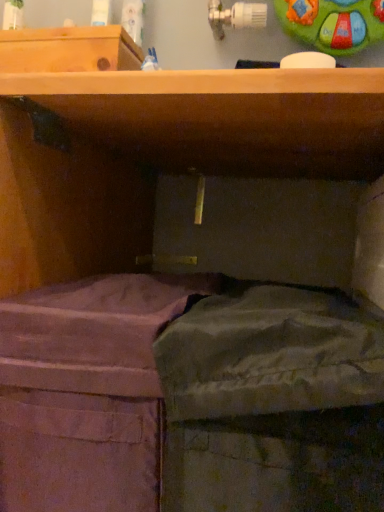
Question: Is pink fabric at lower left, which is the 1th wide from left to right, at the back of green crumpled paper at lower right, which is the 2th wide in left-to-right order?

Choices:
 (A) yes
 (B) no

Answer: (B)

Question: Does green crumpled paper at lower right, the first wide in the right-to-left sequence, have a larger size compared to pink fabric at lower left, which is the 1th wide from left to right?

Choices:
 (A) no
 (B) yes

Answer: (A)

Question: Does green crumpled paper at lower right, which is the 2th wide in left-to-right order, appear on the right side of pink fabric at lower left, which is the 1th wide from left to right?

Choices:
 (A) yes
 (B) no

Answer: (A)

Question: Can you confirm if green crumpled paper at lower right, which is the 2th wide in left-to-right order, is taller than pink fabric at lower left, the 2th wide viewed from the right?

Choices:
 (A) no
 (B) yes

Answer: (A)

Question: From the image's perspective, is green crumpled paper at lower right, the first wide in the right-to-left sequence, located beneath pink fabric at lower left, which is the 1th wide from left to right?

Choices:
 (A) yes
 (B) no

Answer: (B)

Question: Is green crumpled paper at lower right, the first wide in the right-to-left sequence, positioned before pink fabric at lower left, the 2th wide viewed from the right?

Choices:
 (A) yes
 (B) no

Answer: (A)

Question: Considering the relative sizes of pink fabric at lower left, the 2th wide viewed from the right, and green crumpled paper at lower right, which is the 2th wide in left-to-right order, in the image provided, is pink fabric at lower left, the 2th wide viewed from the right, taller than green crumpled paper at lower right, which is the 2th wide in left-to-right order,?

Choices:
 (A) no
 (B) yes

Answer: (B)

Question: Is pink fabric at lower left, the 2th wide viewed from the right, outside green crumpled paper at lower right, which is the 2th wide in left-to-right order?

Choices:
 (A) yes
 (B) no

Answer: (A)

Question: Is pink fabric at lower left, which is the 1th wide from left to right, thinner than green crumpled paper at lower right, which is the 2th wide in left-to-right order?

Choices:
 (A) yes
 (B) no

Answer: (A)

Question: From the image's perspective, is pink fabric at lower left, the 2th wide viewed from the right, on top of green crumpled paper at lower right, which is the 2th wide in left-to-right order?

Choices:
 (A) no
 (B) yes

Answer: (A)

Question: Is pink fabric at lower left, the 2th wide viewed from the right, far from green crumpled paper at lower right, which is the 2th wide in left-to-right order?

Choices:
 (A) no
 (B) yes

Answer: (A)

Question: Is pink fabric at lower left, the 2th wide viewed from the right, next to green crumpled paper at lower right, which is the 2th wide in left-to-right order, and touching it?

Choices:
 (A) yes
 (B) no

Answer: (B)

Question: In the image, is green crumpled paper at lower right, the first wide in the right-to-left sequence, positioned in front of or behind pink fabric at lower left, the 2th wide viewed from the right?

Choices:
 (A) front
 (B) behind

Answer: (A)